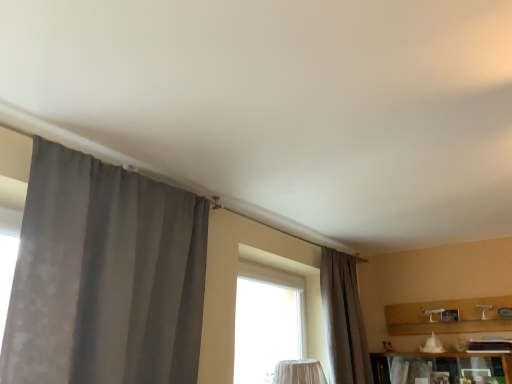
Question: Can you see gray fabric curtain at left, which ranks as the second curtain in back-to-front order, touching gray textured curtain at center, acting as the 1th curtain starting from the right?

Choices:
 (A) yes
 (B) no

Answer: (B)

Question: Is the depth of gray fabric curtain at left, which ranks as the second curtain in back-to-front order, greater than that of gray textured curtain at center, arranged as the 1th curtain when viewed from the back?

Choices:
 (A) no
 (B) yes

Answer: (A)

Question: Can you confirm if gray fabric curtain at left, which is counted as the first curtain, starting from the front, is taller than gray textured curtain at center, arranged as the 1th curtain when viewed from the back?

Choices:
 (A) no
 (B) yes

Answer: (A)

Question: From the image's perspective, is gray fabric curtain at left, which appears as the 2th curtain when viewed from the right, above gray textured curtain at center, arranged as the 1th curtain when viewed from the back?

Choices:
 (A) yes
 (B) no

Answer: (A)

Question: From a real-world perspective, is gray fabric curtain at left, which appears as the 2th curtain when viewed from the right, over gray textured curtain at center, arranged as the 1th curtain when viewed from the back?

Choices:
 (A) yes
 (B) no

Answer: (A)

Question: Considering the relative positions of gray fabric curtain at left, which appears as the 2th curtain when viewed from the right, and gray textured curtain at center, arranged as the 1th curtain when viewed from the back, in the image provided, is gray fabric curtain at left, which appears as the 2th curtain when viewed from the right, to the right of gray textured curtain at center, arranged as the 1th curtain when viewed from the back, from the viewer's perspective?

Choices:
 (A) no
 (B) yes

Answer: (A)

Question: From the image's perspective, does gray textured curtain at center, acting as the 1th curtain starting from the right, appear higher than gray fabric curtain at left, which ranks as the second curtain in back-to-front order?

Choices:
 (A) yes
 (B) no

Answer: (B)

Question: From the image's perspective, would you say gray textured curtain at center, acting as the 1th curtain starting from the right, is shown under gray fabric curtain at left, which appears as the 2th curtain when viewed from the right?

Choices:
 (A) no
 (B) yes

Answer: (B)

Question: Are gray textured curtain at center, acting as the 1th curtain starting from the right, and gray fabric curtain at left, which ranks as the second curtain in back-to-front order, located far from each other?

Choices:
 (A) no
 (B) yes

Answer: (B)

Question: Can you see gray textured curtain at center, positioned as the 2th curtain in front-to-back order, touching gray fabric curtain at left, which is counted as the first curtain, starting from the front?

Choices:
 (A) yes
 (B) no

Answer: (B)

Question: Is gray textured curtain at center, arranged as the 1th curtain when viewed from the back, positioned in front of gray fabric curtain at left, which ranks as the second curtain in back-to-front order?

Choices:
 (A) yes
 (B) no

Answer: (B)

Question: Can you confirm if gray textured curtain at center, the 2th curtain from the left, is shorter than gray fabric curtain at left, which is counted as the first curtain, starting from the front?

Choices:
 (A) yes
 (B) no

Answer: (B)

Question: From the image's perspective, is gray textured curtain at center, arranged as the 1th curtain when viewed from the back, above or below gray fabric curtain at left, which ranks as the second curtain in back-to-front order?

Choices:
 (A) below
 (B) above

Answer: (A)